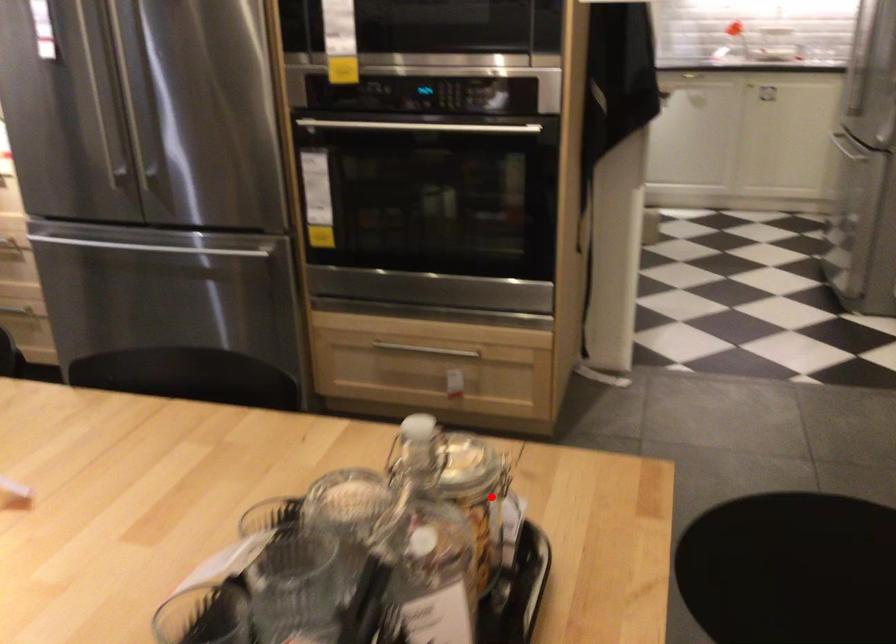
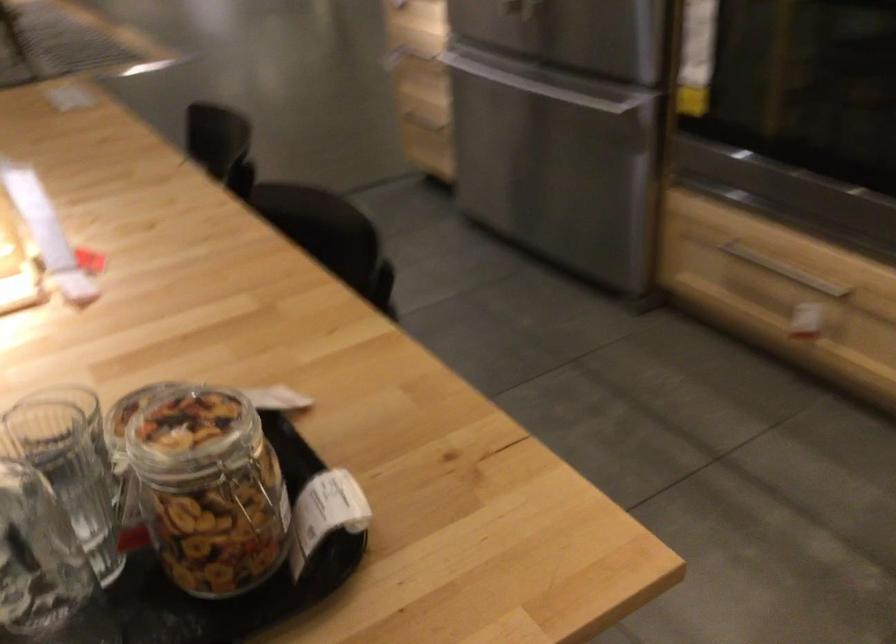
Question: I am providing you with two images of the same scene from different viewpoints. In image1, a red point is highlighted. Considering the same 3D point in image2, which of the following is correct?

Choices:
 (A) It is closer
 (B) It is farther

Answer: (A)